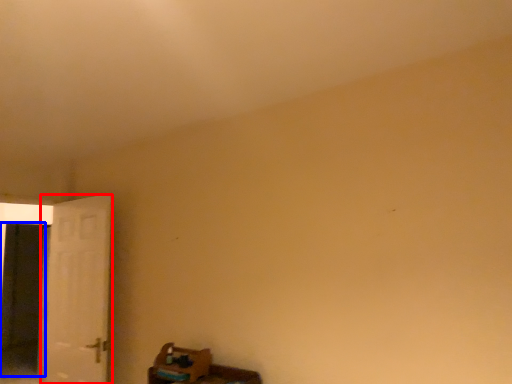
Question: Which of the following is the closest to the observer, door (highlighted by a red box) or screen door (highlighted by a blue box)?

Choices:
 (A) door
 (B) screen door

Answer: (A)